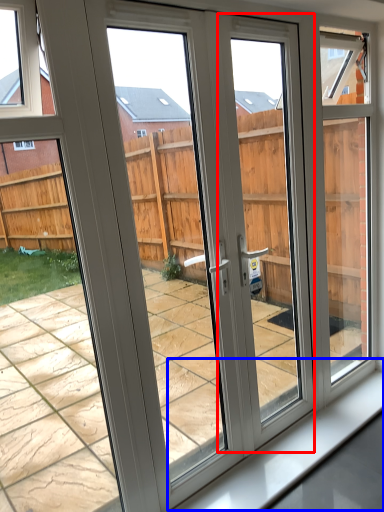
Question: Among these objects, which one is farthest to the camera, screen door (highlighted by a red box) or window sill (highlighted by a blue box)?

Choices:
 (A) screen door
 (B) window sill

Answer: (B)